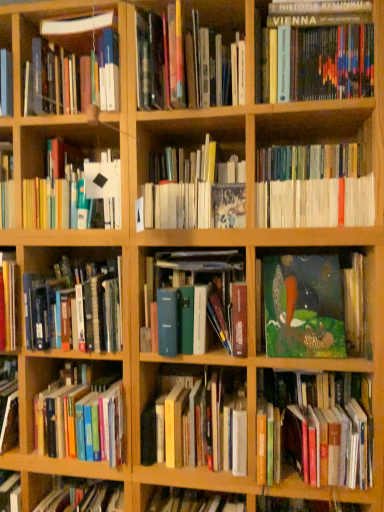
Describe the element at coordinates (181, 62) in the screenshot. I see `hardcover book at upper center, arranged as the 12th book when ordered from the bottom` at that location.

What is the approximate height of hardcover book at upper center, which is the 1th book from top to bottom?

13.82 inches.

This screenshot has height=512, width=384. Describe the element at coordinates (198, 422) in the screenshot. I see `hardcover book at center, arranged as the second book when ordered from the bottom` at that location.

The height and width of the screenshot is (512, 384). I want to click on hardcover book at upper center, which is the 1th book from top to bottom, so click(181, 62).

Locate an element on the screen. This screenshot has width=384, height=512. the 2nd book behind when counting from the white matte book at center, the 6th book when ordered from top to bottom is located at coordinates (198, 422).

How distant is hardcover book at center, arranged as the second book when ordered from the bottom, from white matte book at center, the seventh book in the bottom-to-top sequence?

The distance of hardcover book at center, arranged as the second book when ordered from the bottom, from white matte book at center, the seventh book in the bottom-to-top sequence, is 26.53 inches.

Is hardcover book at center, positioned as the eleventh book in top-to-bottom order, wider or thinner than white matte book at center, the seventh book in the bottom-to-top sequence?

In the image, hardcover book at center, positioned as the eleventh book in top-to-bottom order, appears to be more narrow than white matte book at center, the seventh book in the bottom-to-top sequence.

Is hardcover book at center, arranged as the second book when ordered from the bottom, facing away from white matte book at center, the seventh book in the bottom-to-top sequence?

No, white matte book at center, the seventh book in the bottom-to-top sequence, is not at the back of hardcover book at center, arranged as the second book when ordered from the bottom.

Can you see blue hardcover book at center, which ranks as the ninth book in top-to-bottom order, touching white matte book at upper right, which ranks as the ninth book in bottom-to-top order?

No, blue hardcover book at center, which ranks as the ninth book in top-to-bottom order, is not touching white matte book at upper right, which ranks as the ninth book in bottom-to-top order.

Looking at this image, does blue hardcover book at center, which ranks as the ninth book in top-to-bottom order, appear on the right side of white matte book at upper right, which ranks as the ninth book in bottom-to-top order?

In fact, blue hardcover book at center, which ranks as the ninth book in top-to-bottom order, is to the left of white matte book at upper right, which ranks as the ninth book in bottom-to-top order.

What's the angular difference between blue hardcover book at center, which ranks as the ninth book in top-to-bottom order, and white matte book at upper right, which ranks as the ninth book in bottom-to-top order,'s facing directions?

0.000514 degrees.

Considering the sizes of objects blue hardcover book at center, which ranks as the ninth book in top-to-bottom order, and white matte book at upper right, the fourth book in the top-to-bottom sequence, in the image provided, who is bigger, blue hardcover book at center, which ranks as the ninth book in top-to-bottom order, or white matte book at upper right, the fourth book in the top-to-bottom sequence,?

Bigger between the two is white matte book at upper right, the fourth book in the top-to-bottom sequence.

Is hardcover book at center, arranged as the second book when ordered from the bottom, not near hardcover books at lower left, which ranks as the 1th book in bottom-to-top order?

Actually, hardcover book at center, arranged as the second book when ordered from the bottom, and hardcover books at lower left, which ranks as the 1th book in bottom-to-top order, are a little close together.

Considering the relative sizes of hardcover book at center, positioned as the eleventh book in top-to-bottom order, and hardcover books at lower left, which ranks as the twelfth book in top-to-bottom order, in the image provided, is hardcover book at center, positioned as the eleventh book in top-to-bottom order, wider than hardcover books at lower left, which ranks as the twelfth book in top-to-bottom order,?

No, hardcover book at center, positioned as the eleventh book in top-to-bottom order, is not wider than hardcover books at lower left, which ranks as the twelfth book in top-to-bottom order.

Consider the image. From a real-world perspective, is hardcover book at center, arranged as the second book when ordered from the bottom, beneath hardcover books at lower left, which ranks as the twelfth book in top-to-bottom order?

No, from a real-world perspective, hardcover book at center, arranged as the second book when ordered from the bottom, is not beneath hardcover books at lower left, which ranks as the twelfth book in top-to-bottom order.

Which is less distant, [228,423] or [52,402]?

Point [228,423] appears to be closer to the viewer than point [52,402].

In the scene shown: Which is more distant, (315, 201) or (191, 306)?

The point (191, 306) is behind.

In order to click on the 4th book to the right of the blue hardcover book at center, which ranks as the ninth book in top-to-bottom order, counting from the anchor's position in this screenshot , I will do `click(313, 187)`.

In the image, is white matte book at upper right, which ranks as the ninth book in bottom-to-top order, positioned in front of or behind blue hardcover book at center, which ranks as the ninth book in top-to-bottom order?

In the image, white matte book at upper right, which ranks as the ninth book in bottom-to-top order, appears in front of blue hardcover book at center, which ranks as the ninth book in top-to-bottom order.

From a real-world perspective, relative to blue hardcover book at center, which ranks as the ninth book in top-to-bottom order, is white matte book at upper right, the fourth book in the top-to-bottom sequence, vertically above or below?

Clearly, from a real-world perspective, white matte book at upper right, the fourth book in the top-to-bottom sequence, is above blue hardcover book at center, which ranks as the ninth book in top-to-bottom order.

Identify the location of the 8th book positioned above the blue hardcover book at center, which ranks as the ninth book in top-to-bottom order (from the image's perspective). (181, 62).

Would you consider hardcover book at upper center, which is the 1th book from top to bottom, to be distant from blue hardcover book at center, the fourth book in the bottom-to-top sequence?

That's not correct — hardcover book at upper center, which is the 1th book from top to bottom, is a little close to blue hardcover book at center, the fourth book in the bottom-to-top sequence.

From the image's perspective, would you say hardcover book at upper center, arranged as the 12th book when ordered from the bottom, is shown under blue hardcover book at center, which ranks as the ninth book in top-to-bottom order?

No.

Would you say hardcover book at upper center, which is the 1th book from top to bottom, is outside blue hardcover book at center, which ranks as the ninth book in top-to-bottom order?

Yes, hardcover book at upper center, which is the 1th book from top to bottom, is located beyond the bounds of blue hardcover book at center, which ranks as the ninth book in top-to-bottom order.

Is oil painting at center, which is the 8th book from top to bottom, far from hardcover book at upper left, positioned as the eleventh book in bottom-to-top order?

No, oil painting at center, which is the 8th book from top to bottom, is in close proximity to hardcover book at upper left, positioned as the eleventh book in bottom-to-top order.

Considering the points (361, 324) and (85, 100), which point is behind, point (361, 324) or point (85, 100)?

The point (85, 100) is farther from the camera.

Consider the image. Is oil painting at center, the fifth book in the bottom-to-top sequence, positioned behind hardcover book at upper left, positioned as the eleventh book in bottom-to-top order?

Yes, it is.

Which of these two, oil painting at center, which is the 8th book from top to bottom, or hardcover book at upper left, marked as the second book in a top-to-bottom arrangement, is bigger?

With larger size is hardcover book at upper left, marked as the second book in a top-to-bottom arrangement.

From the image's perspective, between hardcover book at upper left, positioned as the eleventh book in bottom-to-top order, and hardcover book at upper center, which is the 1th book from top to bottom, which one is located above?

hardcover book at upper center, which is the 1th book from top to bottom.

Based on the photo, which is more to the right, hardcover book at upper left, positioned as the eleventh book in bottom-to-top order, or hardcover book at upper center, which is the 1th book from top to bottom?

From the viewer's perspective, hardcover book at upper center, which is the 1th book from top to bottom, appears more on the right side.

Which book is the 3rd one when counting from the left side of the hardcover book at upper center, which is the 1th book from top to bottom? Please provide its 2D coordinates.

[(74, 69)]

Is hardcover book at upper left, marked as the second book in a top-to-bottom arrangement, touching hardcover book at upper center, which is the 1th book from top to bottom?

No, hardcover book at upper left, marked as the second book in a top-to-bottom arrangement, is not with hardcover book at upper center, which is the 1th book from top to bottom.

Locate an element on the screen. book that is the 5th object located above the hardcover book at center, arranged as the second book when ordered from the bottom (from the image's perspective) is located at coordinates (195, 190).

From the image's perspective, count 5th books downward from the white matte book at upper right, the fourth book in the top-to-bottom sequence, and point to it. Please provide its 2D coordinates.

[(198, 302)]

When comparing their distances from blue hardcover book at center, the fourth book in the bottom-to-top sequence, does white matte book at upper left, which appears as the eighth book when ordered from the bottom, or hardcover book at upper right, which is the third book from top to bottom, seem further?

The object further to blue hardcover book at center, the fourth book in the bottom-to-top sequence, is hardcover book at upper right, which is the third book from top to bottom.

Considering their positions, is hardcover books at lower left, which ranks as the twelfth book in top-to-bottom order, positioned closer to blue hardcover book at center, the fourth book in the bottom-to-top sequence, than oil painting at center, which is the 8th book from top to bottom?

oil painting at center, which is the 8th book from top to bottom, lies closer to blue hardcover book at center, the fourth book in the bottom-to-top sequence, than the other object.

When comparing their distances from oil painting at center, the fifth book in the bottom-to-top sequence, does white matte book at upper left, the fifth book positioned from the top, or hardcover books at lower left, which ranks as the 1th book in bottom-to-top order, seem further?

Among the two, hardcover books at lower left, which ranks as the 1th book in bottom-to-top order, is located further to oil painting at center, the fifth book in the bottom-to-top sequence.

Based on their spatial positions, is hardcover book at upper center, arranged as the 12th book when ordered from the bottom, or green matte painting at center right, the third book in the bottom-to-top sequence, further from white matte book at upper right, which ranks as the ninth book in bottom-to-top order?

The object further to white matte book at upper right, which ranks as the ninth book in bottom-to-top order, is green matte painting at center right, the third book in the bottom-to-top sequence.

Looking at the image, which one is located closer to white matte book at upper left, the fifth book positioned from the top, hardcover book at upper left, positioned as the eleventh book in bottom-to-top order, or hardcover book at upper center, which is the 1th book from top to bottom?

hardcover book at upper left, positioned as the eleventh book in bottom-to-top order, is closer to white matte book at upper left, the fifth book positioned from the top.

When comparing their distances from white matte book at center, the seventh book in the bottom-to-top sequence, does oil painting at center, which is the 8th book from top to bottom, or green matte painting at center right, which is counted as the tenth book, starting from the top, seem further?

green matte painting at center right, which is counted as the tenth book, starting from the top.

From the image, which object appears to be nearer to white matte book at center, the 6th book when ordered from top to bottom, oil painting at center, the fifth book in the bottom-to-top sequence, or hardcover book at upper right, which is the third book from top to bottom?

Based on the image, oil painting at center, the fifth book in the bottom-to-top sequence, appears to be nearer to white matte book at center, the 6th book when ordered from top to bottom.

From the image, which object appears to be nearer to hardcover books at lower left, which ranks as the twelfth book in top-to-bottom order, hardcover book at upper left, positioned as the eleventh book in bottom-to-top order, or hardcover book at upper right, which is the third book from top to bottom?

hardcover book at upper left, positioned as the eleventh book in bottom-to-top order.

In order to click on book between blue hardcover book at center, which ranks as the ninth book in top-to-bottom order, and hardcover book at center, arranged as the second book when ordered from the bottom, in the up-down direction in this screenshot , I will do `click(312, 431)`.